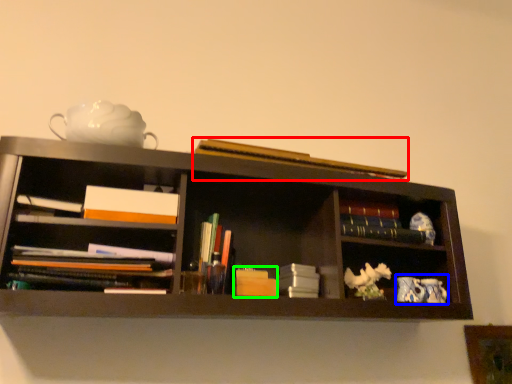
Question: Which object is positioned closest to book (highlighted by a red box)? Select from tea set (highlighted by a blue box) and book (highlighted by a green box).

Choices:
 (A) tea set
 (B) book

Answer: (B)